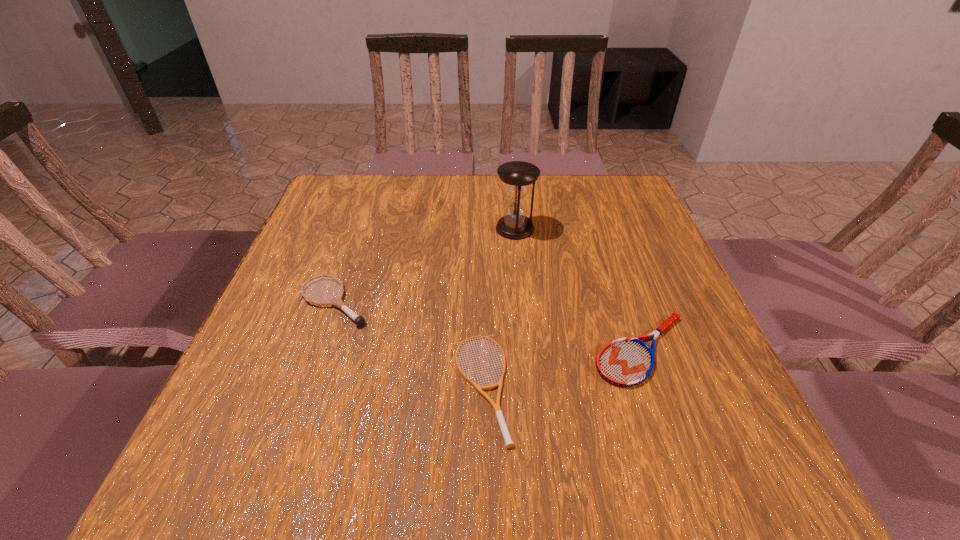
I want to click on the tallest object, so click(x=518, y=176).

The width and height of the screenshot is (960, 540). I want to click on hourglass, so click(518, 176).

Where is `the leftmost object`? The image size is (960, 540). the leftmost object is located at coordinates (337, 301).

This screenshot has height=540, width=960. Find the location of `the leftmost tennis racket`. the leftmost tennis racket is located at coordinates (337, 301).

Where is `the rightmost tennis racket`? The image size is (960, 540). the rightmost tennis racket is located at coordinates (625, 362).

At what (x,y) coordinates should I click in order to perform the action: click on the second tennis racket from right to left. Please return your answer as a coordinate pair (x, y). This screenshot has width=960, height=540. Looking at the image, I should click on (496, 407).

Where is `blank area located on the right of the tallest object`? The width and height of the screenshot is (960, 540). blank area located on the right of the tallest object is located at coordinates (585, 228).

Image resolution: width=960 pixels, height=540 pixels. I want to click on blank space located on the right of the second tallest object, so 512,302.

Locate an element on the screen. The height and width of the screenshot is (540, 960). vacant space positioned on the left of the rightmost object is located at coordinates (441, 349).

The height and width of the screenshot is (540, 960). Find the location of `vacant space positioned on the back of the second tennis racket from right to left`. vacant space positioned on the back of the second tennis racket from right to left is located at coordinates (480, 307).